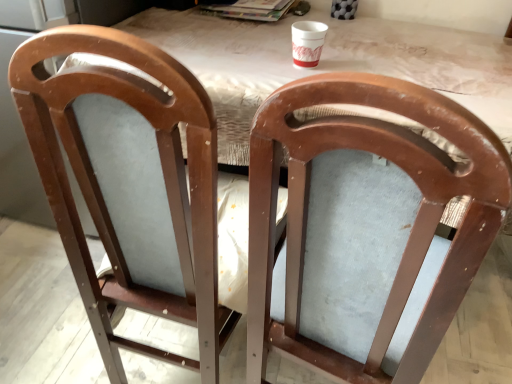
Question: In which direction should I rotate to look at matte wood chair at center, which ranks as the 1th chair in right-to-left order?

Choices:
 (A) left
 (B) right

Answer: (B)

Question: Considering the relative sizes of white paper cup at upper center and matte wood chair at center, which ranks as the 1th chair in right-to-left order, in the image provided, is white paper cup at upper center thinner than matte wood chair at center, which ranks as the 1th chair in right-to-left order,?

Choices:
 (A) yes
 (B) no

Answer: (A)

Question: Is white paper cup at upper center wider than matte wood chair at center, the second chair in the left-to-right sequence?

Choices:
 (A) no
 (B) yes

Answer: (A)

Question: From the image's perspective, is white paper cup at upper center on top of matte wood chair at center, the second chair in the left-to-right sequence?

Choices:
 (A) yes
 (B) no

Answer: (A)

Question: Is white paper cup at upper center taller than matte wood chair at center, which ranks as the 1th chair in right-to-left order?

Choices:
 (A) no
 (B) yes

Answer: (A)

Question: Does white paper cup at upper center come in front of matte wood chair at center, which ranks as the 1th chair in right-to-left order?

Choices:
 (A) no
 (B) yes

Answer: (A)

Question: Could matte wood chair at center, which ranks as the 1th chair in right-to-left order, be considered to be inside white paper cup at upper center?

Choices:
 (A) yes
 (B) no

Answer: (B)

Question: Can you confirm if matte wood table at center is positioned to the left of white paper cup at upper center?

Choices:
 (A) no
 (B) yes

Answer: (A)

Question: Does matte wood table at center have a smaller size compared to white paper cup at upper center?

Choices:
 (A) no
 (B) yes

Answer: (A)

Question: From a real-world perspective, is matte wood table at center physically above white paper cup at upper center?

Choices:
 (A) yes
 (B) no

Answer: (B)

Question: Does matte wood table at center have a larger size compared to white paper cup at upper center?

Choices:
 (A) no
 (B) yes

Answer: (B)

Question: From a real-world perspective, is matte wood table at center physically below white paper cup at upper center?

Choices:
 (A) yes
 (B) no

Answer: (A)

Question: From the image's perspective, is matte wood table at center below white paper cup at upper center?

Choices:
 (A) yes
 (B) no

Answer: (A)

Question: Does matte wood chair at center, the second chair in the left-to-right sequence, have a lesser height compared to matte wood chair at center, placed as the 2th chair when sorted from right to left?

Choices:
 (A) no
 (B) yes

Answer: (B)